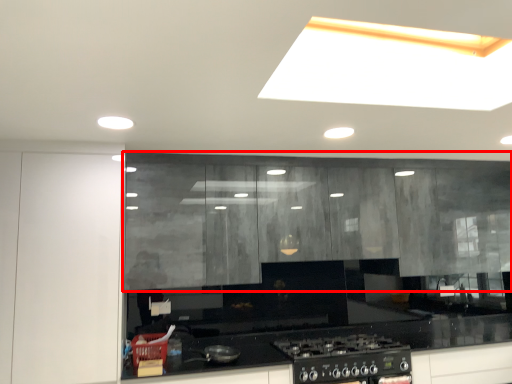
Question: From the image's perspective, what is the correct spatial relationship of cabinetry (annotated by the red box) in relation to glass door?

Choices:
 (A) above
 (B) below

Answer: (A)